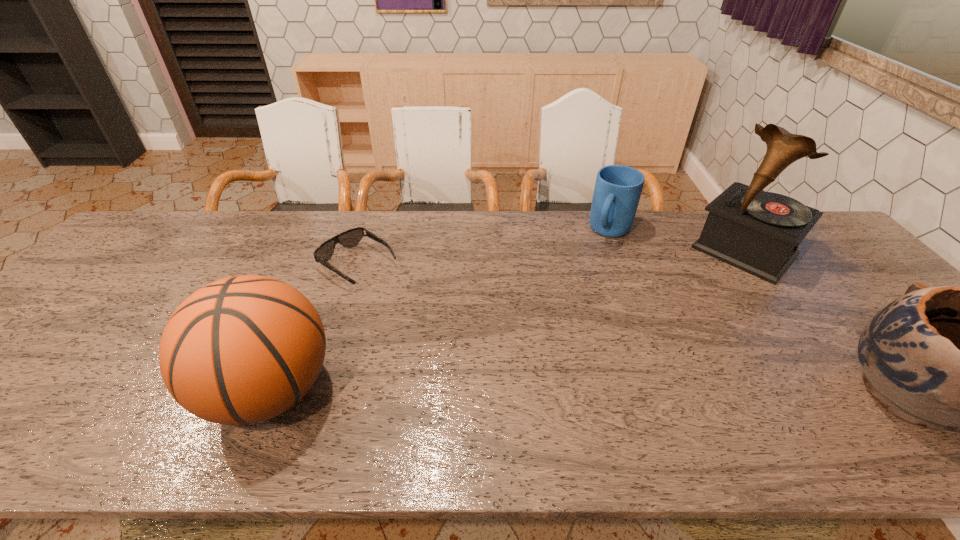
This screenshot has width=960, height=540. What are the coordinates of `vacant space that's between the phonograph_record and the fourth shortest object` in the screenshot? It's located at (507, 320).

Locate which object is the third closest to the third object from right to left. Please provide its 2D coordinates. Your answer should be formatted as a tuple, i.e. [(x, y)], where the tuple contains the x and y coordinates of a point satisfying the conditions above.

[(352, 237)]

Where is `object that is the second closest one to the shortest object`? The image size is (960, 540). object that is the second closest one to the shortest object is located at coordinates click(x=617, y=191).

Find the location of a particular element. free region that satisfies the following two spatial constraints: 1. on the back side of the shortest object; 2. on the left side of the basketball is located at coordinates (323, 265).

Locate an element on the screen. This screenshot has height=540, width=960. free point that satisfies the following two spatial constraints: 1. on the back side of the basketball; 2. on the left side of the shortest object is located at coordinates (323, 265).

The image size is (960, 540). In order to click on free spot that satisfies the following two spatial constraints: 1. on the back side of the tallest object; 2. on the left side of the fourth shortest object in this screenshot , I will do `click(328, 251)`.